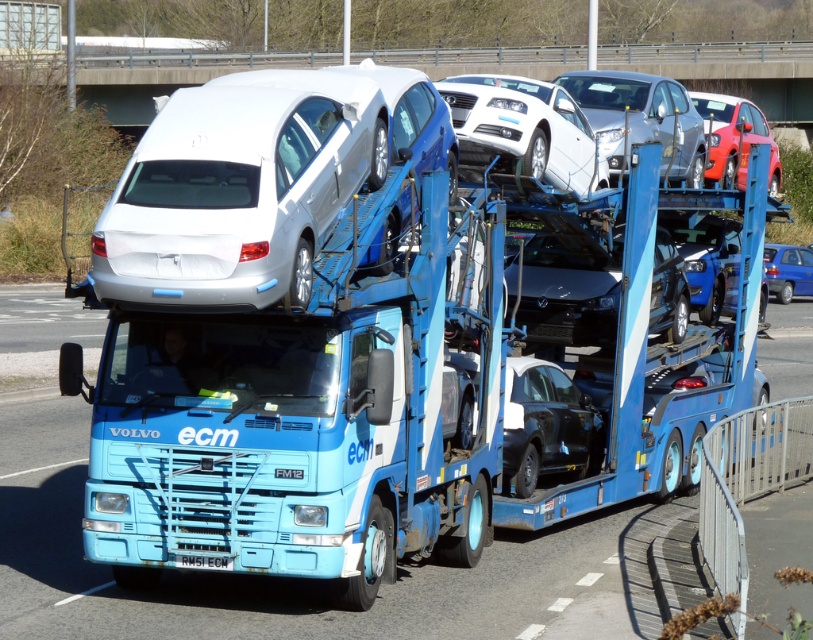
Question: Among these points, which one is farthest from the camera?

Choices:
 (A) (342, 374)
 (B) (381, 96)

Answer: (B)

Question: Can you confirm if white glossy sedan at upper center is bigger than white plastic license plate at center?

Choices:
 (A) no
 (B) yes

Answer: (B)

Question: Does shiny red car at upper right appear under blue metallic hatchback at right?

Choices:
 (A) yes
 (B) no

Answer: (B)

Question: Is satin silver car at center bigger than white plastic license plate at center?

Choices:
 (A) no
 (B) yes

Answer: (B)

Question: Estimate the real-world distances between objects in this image. Which object is closer to the white glossy sedan at upper center?

Choices:
 (A) metallic silver sedan at upper right
 (B) blue metallic hatchback at right
 (C) white plastic license plate at center

Answer: (A)

Question: Which of the following is the closest to the observer?

Choices:
 (A) (387, 344)
 (B) (201, 561)
 (C) (220, 266)

Answer: (C)